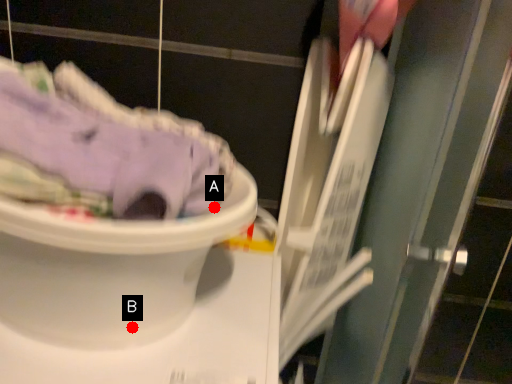
Question: Two points are circled on the image, labeled by A and B beside each circle. Which of the following is the closest to the observer?

Choices:
 (A) A is closer
 (B) B is closer

Answer: (B)